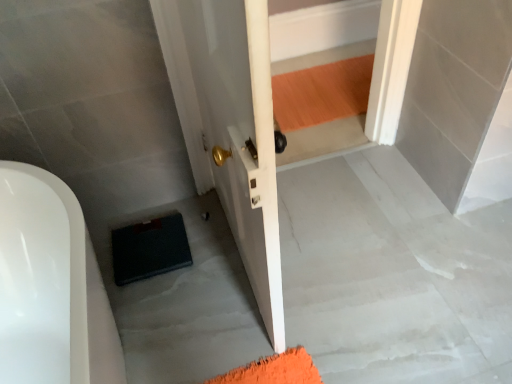
Question: Are dark blue rubber mat at lower left and black matte suitcase at lower left beside each other?

Choices:
 (A) no
 (B) yes

Answer: (A)

Question: From the image's perspective, is dark blue rubber mat at lower left above black matte suitcase at lower left?

Choices:
 (A) no
 (B) yes

Answer: (B)

Question: Does dark blue rubber mat at lower left have a greater height compared to black matte suitcase at lower left?

Choices:
 (A) yes
 (B) no

Answer: (A)

Question: Can you confirm if dark blue rubber mat at lower left is wider than black matte suitcase at lower left?

Choices:
 (A) yes
 (B) no

Answer: (B)

Question: Considering the relative sizes of dark blue rubber mat at lower left and black matte suitcase at lower left in the image provided, is dark blue rubber mat at lower left bigger than black matte suitcase at lower left?

Choices:
 (A) yes
 (B) no

Answer: (B)

Question: Does dark blue rubber mat at lower left have a lesser width compared to black matte suitcase at lower left?

Choices:
 (A) yes
 (B) no

Answer: (A)

Question: Is black matte suitcase at lower left oriented towards dark blue rubber mat at lower left?

Choices:
 (A) yes
 (B) no

Answer: (B)

Question: Would you say black matte suitcase at lower left is a long distance from dark blue rubber mat at lower left?

Choices:
 (A) yes
 (B) no

Answer: (B)

Question: Does black matte suitcase at lower left have a greater height compared to dark blue rubber mat at lower left?

Choices:
 (A) no
 (B) yes

Answer: (A)

Question: From the image's perspective, is black matte suitcase at lower left on top of dark blue rubber mat at lower left?

Choices:
 (A) no
 (B) yes

Answer: (A)

Question: Is black matte suitcase at lower left oriented away from dark blue rubber mat at lower left?

Choices:
 (A) no
 (B) yes

Answer: (A)

Question: Is dark blue rubber mat at lower left inside black matte suitcase at lower left?

Choices:
 (A) no
 (B) yes

Answer: (A)

Question: In the image, is dark blue rubber mat at lower left positioned in front of or behind black matte suitcase at lower left?

Choices:
 (A) front
 (B) behind

Answer: (B)